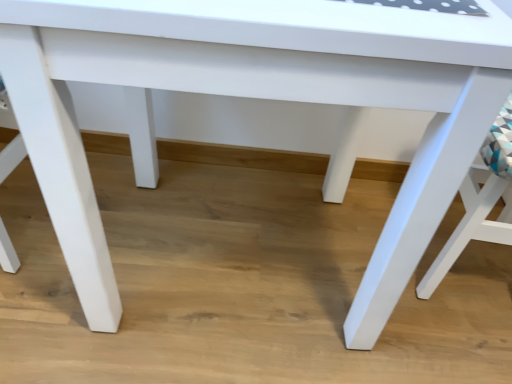
At what (x,y) coordinates should I click in order to perform the action: click on vacant space to the left of white glossy swivel chair at lower right. Please return your answer as a coordinate pair (x, y). Looking at the image, I should click on (342, 249).